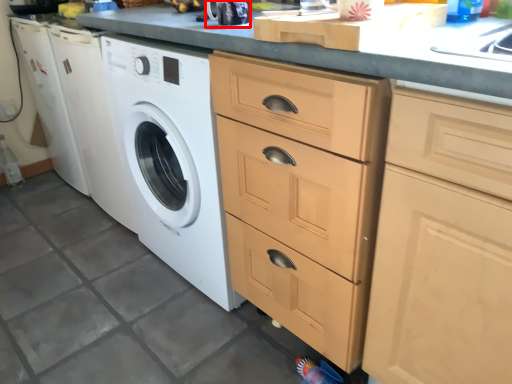
Question: From the image's perspective, considering the relative positions of appliance (annotated by the red box) and cabinetry in the image provided, where is appliance (annotated by the red box) located with respect to the staircase?

Choices:
 (A) below
 (B) above

Answer: (B)